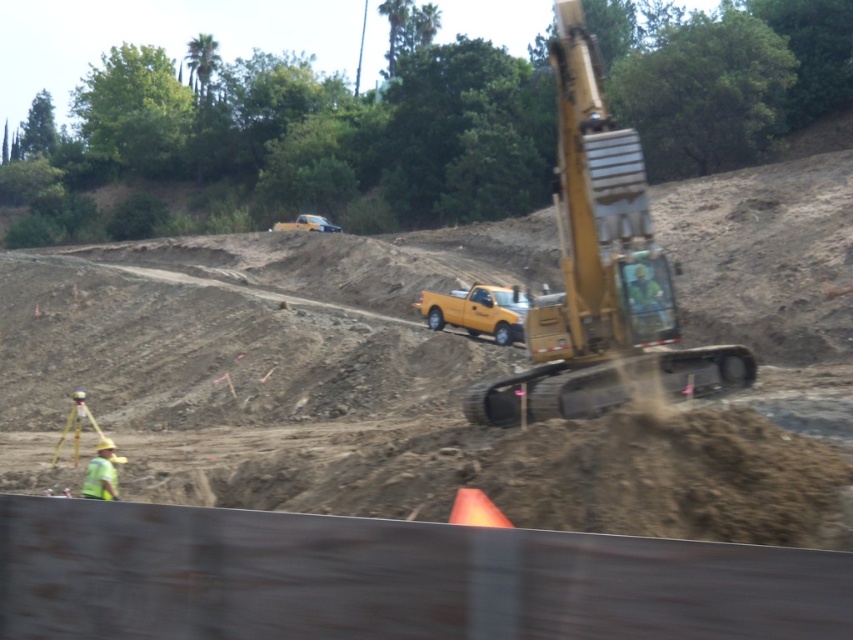
Based on the photo, you are standing at the center of the construction site. You need to move towards the yellow metallic excavator at right. Which direction should you walk?

You should walk to the right because the yellow metallic excavator at right is located at point (601, 273), which is to the right of the center point.

You are standing at point (107, 449) and want to walk to point (567, 81). Is the path between you and your destination clear of any construction equipment?

Point (567, 81) is behind point (107, 449), so the path between you and your destination is blocked by point (107, 449).